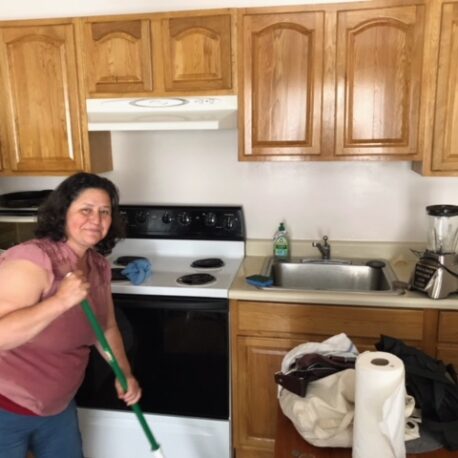
You are a GUI agent. You are given a task and a screenshot of the screen. Output one action in this format:
    pyautogui.click(x=<x>, y=<y>)
    Task: Click on the false drawer
    The width and height of the screenshot is (458, 458).
    Given the screenshot: What is the action you would take?
    click(x=341, y=318)